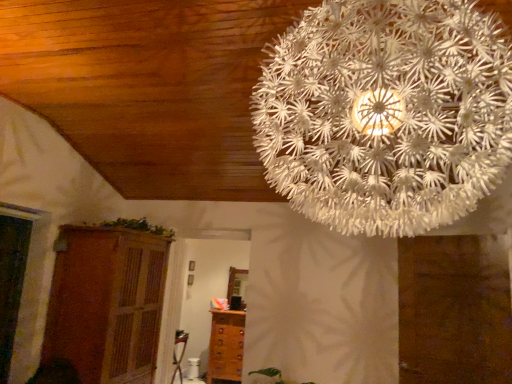
Question: Is wooden cupboard at lower left wider than white paper-like at upper center?

Choices:
 (A) yes
 (B) no

Answer: (B)

Question: Considering the relative sizes of wooden cupboard at lower left and white paper-like at upper center in the image provided, is wooden cupboard at lower left smaller than white paper-like at upper center?

Choices:
 (A) no
 (B) yes

Answer: (A)

Question: Is wooden cupboard at lower left thinner than white paper-like at upper center?

Choices:
 (A) yes
 (B) no

Answer: (A)

Question: Is wooden cupboard at lower left further to the viewer compared to white paper-like at upper center?

Choices:
 (A) yes
 (B) no

Answer: (A)

Question: Is wooden cupboard at lower left positioned in front of white paper-like at upper center?

Choices:
 (A) no
 (B) yes

Answer: (A)

Question: Considering the positions of wooden cupboard at lower left and green leafy plant at upper center in the image, is wooden cupboard at lower left taller or shorter than green leafy plant at upper center?

Choices:
 (A) tall
 (B) short

Answer: (A)

Question: Looking at the image, does wooden cupboard at lower left seem bigger or smaller compared to green leafy plant at upper center?

Choices:
 (A) small
 (B) big

Answer: (B)

Question: In terms of width, does wooden cupboard at lower left look wider or thinner when compared to green leafy plant at upper center?

Choices:
 (A) wide
 (B) thin

Answer: (A)

Question: From the image's perspective, is wooden cupboard at lower left located above or below green leafy plant at upper center?

Choices:
 (A) above
 (B) below

Answer: (B)

Question: Would you say green leafy plant at upper center is to the left or to the right of brown wooden chest of drawers at lower center in the picture?

Choices:
 (A) left
 (B) right

Answer: (A)

Question: Looking at their shapes, would you say green leafy plant at upper center is wider or thinner than brown wooden chest of drawers at lower center?

Choices:
 (A) wide
 (B) thin

Answer: (A)

Question: From the image's perspective, is green leafy plant at upper center above or below brown wooden chest of drawers at lower center?

Choices:
 (A) below
 (B) above

Answer: (B)

Question: Is green leafy plant at upper center in front of or behind brown wooden chest of drawers at lower center in the image?

Choices:
 (A) behind
 (B) front

Answer: (B)

Question: Is white paper-like at upper center situated inside green leafy plant at upper center or outside?

Choices:
 (A) inside
 (B) outside

Answer: (B)

Question: From a real-world perspective, is white paper-like at upper center physically located above or below green leafy plant at upper center?

Choices:
 (A) below
 (B) above

Answer: (B)